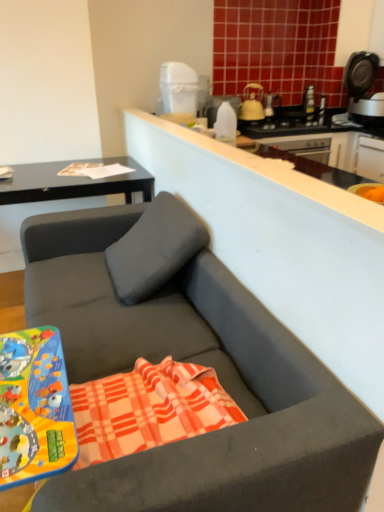
Question: From a real-world perspective, is plaid cotton beach towel at center positioned over matte black desk at upper left based on gravity?

Choices:
 (A) no
 (B) yes

Answer: (B)

Question: Is plaid cotton beach towel at center further to the viewer compared to matte black desk at upper left?

Choices:
 (A) no
 (B) yes

Answer: (A)

Question: Is plaid cotton beach towel at center at the left side of matte black desk at upper left?

Choices:
 (A) no
 (B) yes

Answer: (A)

Question: Considering the relative sizes of plaid cotton beach towel at center and matte black desk at upper left in the image provided, is plaid cotton beach towel at center taller than matte black desk at upper left?

Choices:
 (A) yes
 (B) no

Answer: (B)

Question: Is plaid cotton beach towel at center wider than matte black desk at upper left?

Choices:
 (A) no
 (B) yes

Answer: (A)

Question: Would you say plaid cotton beach towel at center is a long distance from matte black desk at upper left?

Choices:
 (A) no
 (B) yes

Answer: (B)

Question: Is matte gray studio couch at center bigger than transparent plastic bottle at upper center?

Choices:
 (A) yes
 (B) no

Answer: (A)

Question: Is matte gray studio couch at center beside transparent plastic bottle at upper center?

Choices:
 (A) no
 (B) yes

Answer: (A)

Question: Considering the relative positions of matte gray studio couch at center and transparent plastic bottle at upper center in the image provided, is matte gray studio couch at center behind transparent plastic bottle at upper center?

Choices:
 (A) no
 (B) yes

Answer: (A)

Question: Is matte gray studio couch at center outside of transparent plastic bottle at upper center?

Choices:
 (A) no
 (B) yes

Answer: (B)

Question: Is matte gray studio couch at center wider than transparent plastic bottle at upper center?

Choices:
 (A) yes
 (B) no

Answer: (A)

Question: Can you confirm if matte gray studio couch at center is shorter than transparent plastic bottle at upper center?

Choices:
 (A) no
 (B) yes

Answer: (A)

Question: From a real-world perspective, is black plastic coffee machine at upper right on top of plaid cotton beach towel at center?

Choices:
 (A) yes
 (B) no

Answer: (A)